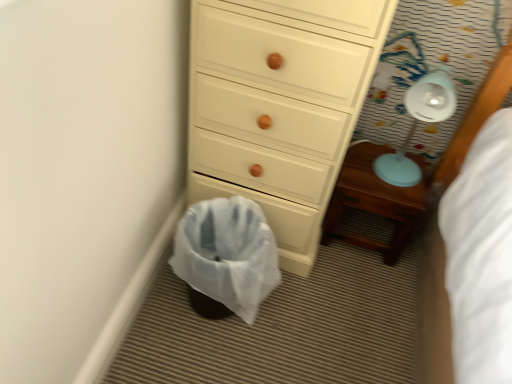
Question: Is white wood chest of drawers at center wider or thinner than white plastic laundry basket at lower center?

Choices:
 (A) thin
 (B) wide

Answer: (B)

Question: From a real-world perspective, is white wood chest of drawers at center positioned above or below white plastic laundry basket at lower center?

Choices:
 (A) above
 (B) below

Answer: (A)

Question: Which of these objects is positioned farthest from the white plastic lamp at upper right?

Choices:
 (A) wooden nightstand at lower right
 (B) white plastic laundry basket at lower center
 (C) white wood chest of drawers at center

Answer: (B)

Question: Which is farther from the wooden nightstand at lower right?

Choices:
 (A) white plastic lamp at upper right
 (B) white wood chest of drawers at center
 (C) white plastic laundry basket at lower center

Answer: (C)